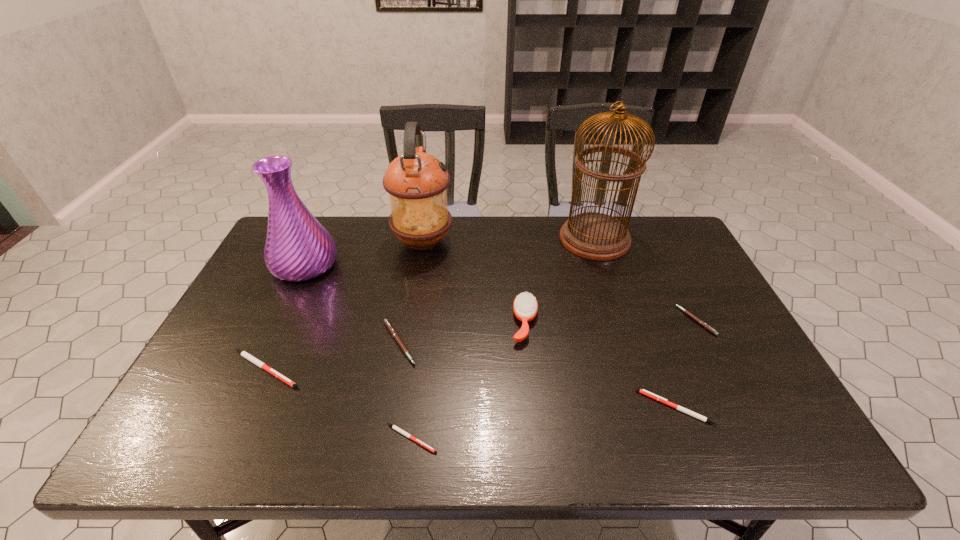
What are the coordinates of `birdcage present at the far edge` in the screenshot? It's located at (595, 236).

The height and width of the screenshot is (540, 960). I want to click on oil lamp located at the far edge, so click(417, 182).

Locate an element on the screen. The width and height of the screenshot is (960, 540). vase present at the far edge is located at coordinates (298, 248).

Locate an element on the screen. vase located at the left edge is located at coordinates (298, 248).

At what (x,y) coordinates should I click in order to perform the action: click on pen positioned at the left edge. Please return your answer as a coordinate pair (x, y). This screenshot has height=540, width=960. Looking at the image, I should click on (246, 355).

Find the location of `object that is at the right edge`. object that is at the right edge is located at coordinates (702, 323).

Image resolution: width=960 pixels, height=540 pixels. I want to click on object that is at the far left corner, so click(x=298, y=248).

In the image, there is a desktop. Where is `free space at the far edge`? The height and width of the screenshot is (540, 960). free space at the far edge is located at coordinates (374, 239).

I want to click on free space at the near edge, so click(x=279, y=421).

Where is `blank area at the left edge`? blank area at the left edge is located at coordinates (252, 311).